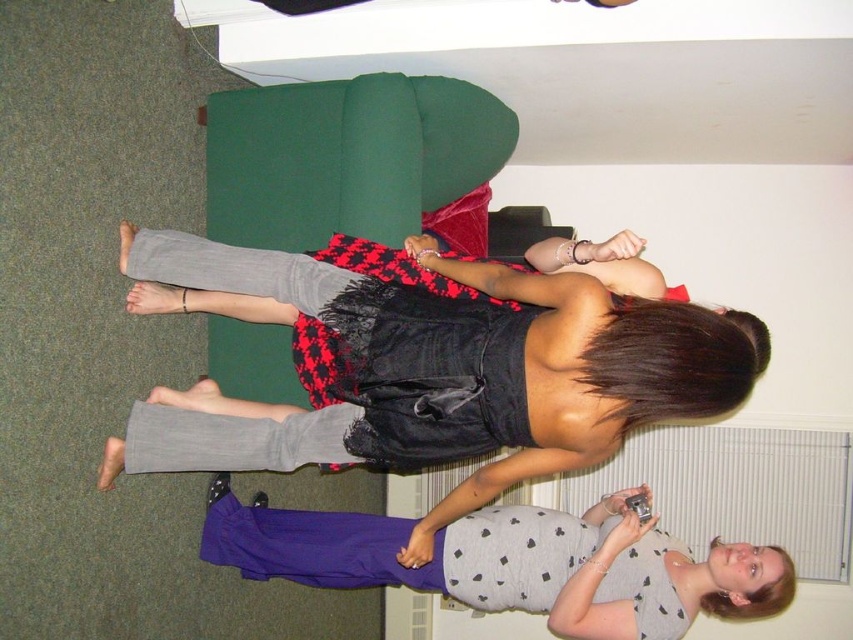
Question: Where is black satin dress at center located in relation to gray dotted tank top at lower center in the image?

Choices:
 (A) left
 (B) right

Answer: (A)

Question: Among these points, which one is nearest to the camera?

Choices:
 (A) (209, 516)
 (B) (416, 531)

Answer: (B)

Question: Which of the following is the closest to the observer?

Choices:
 (A) black satin dress at center
 (B) gray dotted tank top at lower center

Answer: (A)

Question: Considering the relative positions of black satin dress at center and gray dotted tank top at lower center in the image provided, where is black satin dress at center located with respect to gray dotted tank top at lower center?

Choices:
 (A) left
 (B) right

Answer: (A)

Question: Which point is farther to the camera?

Choices:
 (A) (503, 506)
 (B) (286, 308)

Answer: (A)

Question: Does black satin dress at center lie behind gray dotted tank top at lower center?

Choices:
 (A) no
 (B) yes

Answer: (A)